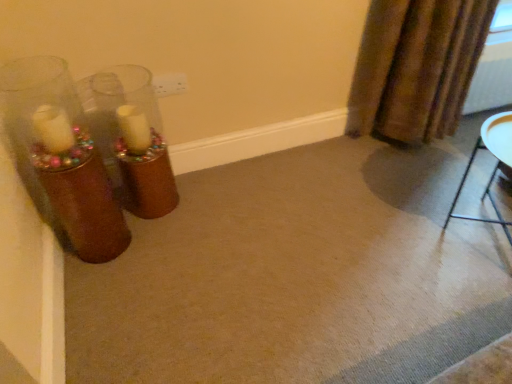
Question: From the image's perspective, is metallic silver tray at lower right positioned above or below brown textured curtain at upper right?

Choices:
 (A) above
 (B) below

Answer: (B)

Question: From a real-world perspective, is metallic silver tray at lower right above or below brown textured curtain at upper right?

Choices:
 (A) below
 (B) above

Answer: (A)

Question: Relative to brown textured curtain at upper right, is metallic silver tray at lower right in front or behind?

Choices:
 (A) behind
 (B) front

Answer: (B)

Question: Does point (479, 24) appear closer or farther from the camera than point (499, 152)?

Choices:
 (A) farther
 (B) closer

Answer: (A)

Question: Choose the correct answer: Is brown textured curtain at upper right inside metallic silver tray at lower right or outside it?

Choices:
 (A) outside
 (B) inside

Answer: (A)

Question: From a real-world perspective, is brown textured curtain at upper right physically located above or below metallic silver tray at lower right?

Choices:
 (A) below
 (B) above

Answer: (B)

Question: In the image, is brown textured curtain at upper right on the left side or the right side of metallic silver tray at lower right?

Choices:
 (A) left
 (B) right

Answer: (A)